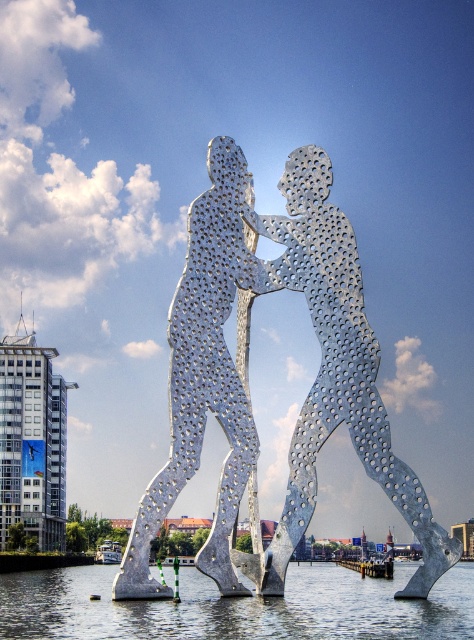
Between point (27, 609) and point (130, 589), which one is positioned in front?

Point (130, 589)

Between clear water at lower center and metallic silver sculpture at center, which one appears on the right side from the viewer's perspective?

clear water at lower center

What do you see at coordinates (237, 608) in the screenshot? This screenshot has width=474, height=640. I see `clear water at lower center` at bounding box center [237, 608].

The height and width of the screenshot is (640, 474). Identify the location of clear water at lower center. (237, 608).

Can you confirm if metallic perforated human figure at center is thinner than metallic silver sculpture at center?

No, metallic perforated human figure at center is not thinner than metallic silver sculpture at center.

Does metallic perforated human figure at center have a lesser height compared to metallic silver sculpture at center?

In fact, metallic perforated human figure at center may be taller than metallic silver sculpture at center.

Where is `metallic perforated human figure at center`? metallic perforated human figure at center is located at coordinates (336, 376).

This screenshot has width=474, height=640. What do you see at coordinates (336, 376) in the screenshot?
I see `metallic perforated human figure at center` at bounding box center [336, 376].

Measure the distance from metallic perforated human figure at center to clear water at lower center.

They are 20.11 meters apart.

Which is behind, point (344, 349) or point (255, 628)?

Positioned behind is point (344, 349).

Where is `metallic perforated human figure at center`? This screenshot has height=640, width=474. metallic perforated human figure at center is located at coordinates (336, 376).